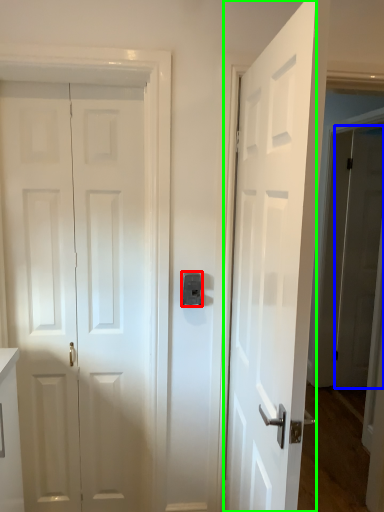
Question: Which object is positioned farthest from latch (highlighted by a red box)? Select from door (highlighted by a blue box) and door (highlighted by a green box).

Choices:
 (A) door
 (B) door

Answer: (A)